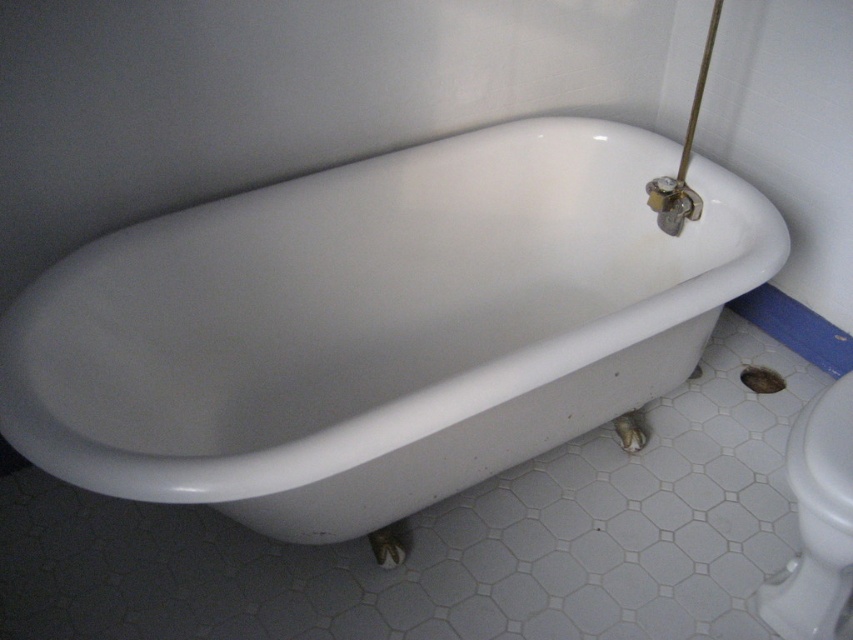
Can you confirm if white glossy bathtub at center is bigger than white glossy toilet bowl at lower right?

Result: Correct, white glossy bathtub at center is larger in size than white glossy toilet bowl at lower right.

Is white glossy bathtub at center shorter than white glossy toilet bowl at lower right?

No.

Does point (405, 381) lie behind point (840, 464)?

Yes.

Find the location of a particular element. white glossy bathtub at center is located at coordinates (376, 326).